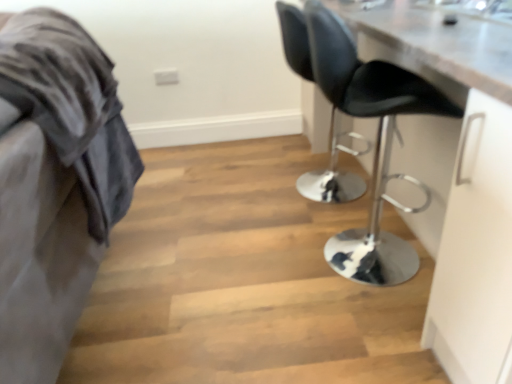
Question: Should I look upward or downward to see velvet grey blanket at left?

Choices:
 (A) down
 (B) up

Answer: (B)

Question: Is black leather chair at center, the first chair when ordered from back to front, beside black leather chair at right, which appears as the 2th chair when viewed from the back?

Choices:
 (A) yes
 (B) no

Answer: (B)

Question: Is black leather chair at center, the first chair when ordered from back to front, completely or partially outside of black leather chair at right, which is the 1th chair from front to back?

Choices:
 (A) no
 (B) yes

Answer: (B)

Question: Does black leather chair at center, the first chair when ordered from back to front, have a smaller size compared to black leather chair at right, which is the 1th chair from front to back?

Choices:
 (A) no
 (B) yes

Answer: (B)

Question: From a real-world perspective, is black leather chair at center, which ranks as the 2th chair in front-to-back order, on top of black leather chair at right, which appears as the 2th chair when viewed from the back?

Choices:
 (A) no
 (B) yes

Answer: (A)

Question: Could you tell me if black leather chair at center, the first chair when ordered from back to front, is turned towards black leather chair at right, which appears as the 2th chair when viewed from the back?

Choices:
 (A) yes
 (B) no

Answer: (B)

Question: Can you confirm if black leather chair at center, the first chair when ordered from back to front, is wider than black leather chair at right, which appears as the 2th chair when viewed from the back?

Choices:
 (A) yes
 (B) no

Answer: (B)

Question: Is black leather chair at right, which is the 1th chair from front to back, at the left side of velvet grey blanket at left?

Choices:
 (A) yes
 (B) no

Answer: (B)

Question: Is black leather chair at right, which appears as the 2th chair when viewed from the back, thinner than velvet grey blanket at left?

Choices:
 (A) yes
 (B) no

Answer: (A)

Question: From the image's perspective, is black leather chair at right, which is the 1th chair from front to back, located beneath velvet grey blanket at left?

Choices:
 (A) no
 (B) yes

Answer: (A)

Question: Is black leather chair at right, which appears as the 2th chair when viewed from the back, facing away from velvet grey blanket at left?

Choices:
 (A) no
 (B) yes

Answer: (B)

Question: Considering the relative sizes of black leather chair at right, which is the 1th chair from front to back, and velvet grey blanket at left in the image provided, is black leather chair at right, which is the 1th chair from front to back, smaller than velvet grey blanket at left?

Choices:
 (A) yes
 (B) no

Answer: (A)

Question: Is there a large distance between black leather chair at right, which is the 1th chair from front to back, and velvet grey blanket at left?

Choices:
 (A) no
 (B) yes

Answer: (A)

Question: From a real-world perspective, is velvet grey blanket at left located beneath black leather chair at center, the first chair when ordered from back to front?

Choices:
 (A) no
 (B) yes

Answer: (A)